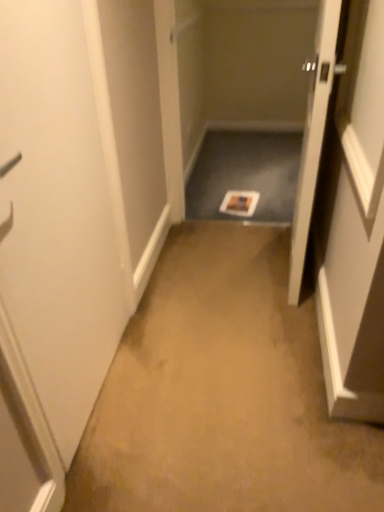
Question: Does point (114, 315) appear closer or farther from the camera than point (218, 202)?

Choices:
 (A) closer
 (B) farther

Answer: (A)

Question: Based on their sizes in the image, would you say white matte door at left, the second door positioned from the right, is bigger or smaller than matte gray tray at center?

Choices:
 (A) small
 (B) big

Answer: (A)

Question: Which is nearer to the white matte door at left, the first door in the left-to-right sequence?

Choices:
 (A) matte gray tray at center
 (B) wooden door at right, the second door from the left

Answer: (B)

Question: Which is farther from the white matte door at left, the second door positioned from the right?

Choices:
 (A) wooden door at right, acting as the 1th door starting from the right
 (B) matte gray tray at center

Answer: (B)